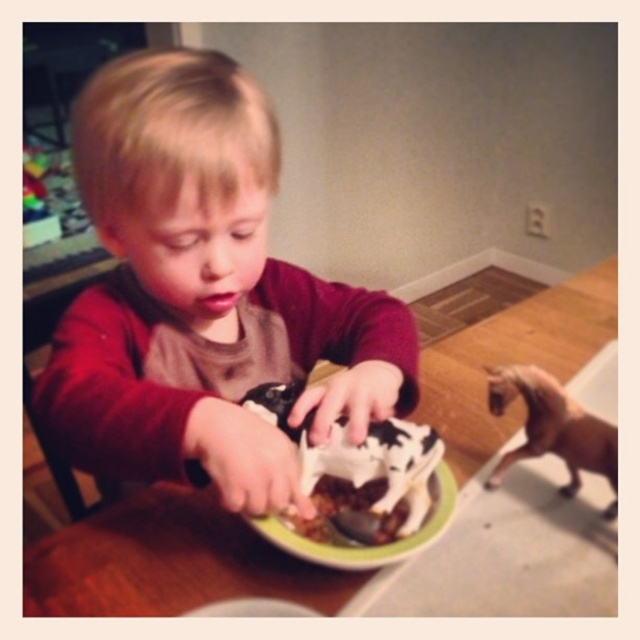
Looking at this image, you are a photographer trying to capture the child eating the dessert. You need to position your camera so that both the matte brown shirt at center and the wooden table at center are in frame. Based on their positions, which object should you place your camera closer to in order to ensure both are visible?

The matte brown shirt at center is positioned on the left side of wooden table at center. To ensure both are visible, the camera should be placed closer to the wooden table at center so that the shirt and table are within the frame.

The wooden table at center and the chocolate frosted cake at center are both at the center of the image. Which one is taller?

The wooden table at center is much taller than the chocolate frosted cake at center.

You are a parent trying to place a rectangular cake box that is 1.2 meters wide on the wooden table at center. Can the chocolate frosted cake at center fit on the table without overhanging the edges?

The wooden table at center is wider than the chocolate frosted cake at center, so the cake box can fit on the table without overhanging the edges.